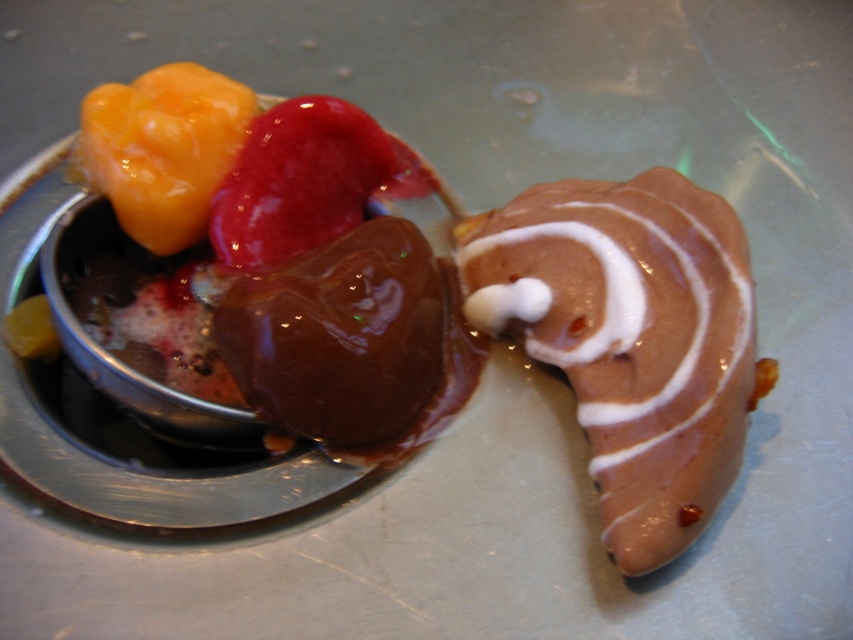
Question: Does chocolate glaze donut at right appear on the right side of shiny red ice cream at center?

Choices:
 (A) yes
 (B) no

Answer: (A)

Question: Which point appears closest to the camera in this image?

Choices:
 (A) (662, 234)
 (B) (241, 253)

Answer: (A)

Question: Does chocolate glaze donut at right appear on the right side of shiny red ice cream at center?

Choices:
 (A) no
 (B) yes

Answer: (B)

Question: Which object appears farthest from the camera in this image?

Choices:
 (A) chocolate glaze donut at right
 (B) shiny red ice cream at center

Answer: (B)

Question: Is chocolate glaze donut at right closer to camera compared to shiny red ice cream at center?

Choices:
 (A) no
 (B) yes

Answer: (B)